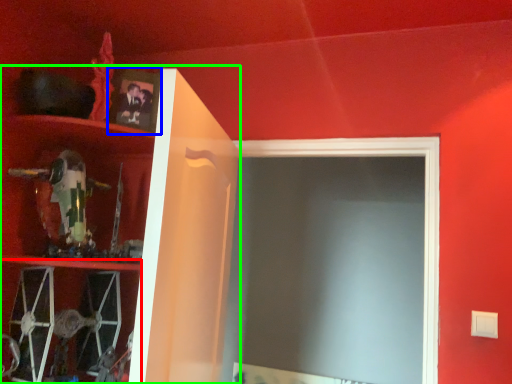
Question: Considering the real-world distances, which object is closest to cabinet (highlighted by a red box)? picture frame (highlighted by a blue box) or cabinet (highlighted by a green box).

Choices:
 (A) picture frame
 (B) cabinet

Answer: (B)